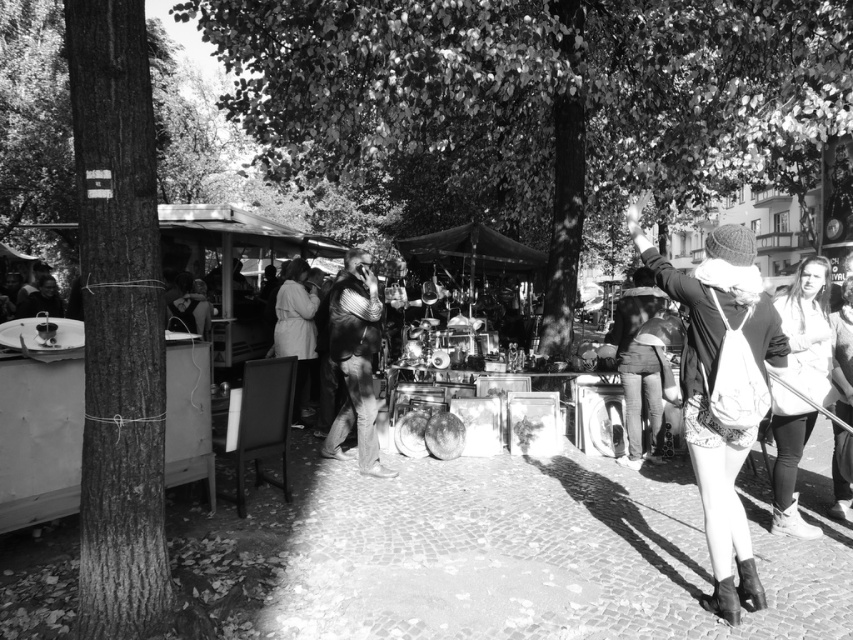
Question: Can you confirm if leather jacket at center is smaller than light beige fabric coat at center?

Choices:
 (A) no
 (B) yes

Answer: (A)

Question: Among these points, which one is nearest to the camera?

Choices:
 (A) (767, 300)
 (B) (300, 284)

Answer: (A)

Question: Which point is farther to the camera?

Choices:
 (A) (378, 328)
 (B) (732, 508)

Answer: (A)

Question: Can you confirm if white textured sweater at right is smaller than leather jacket at center?

Choices:
 (A) no
 (B) yes

Answer: (A)

Question: Is knitted wool hat at upper right wider than light beige fabric coat at center?

Choices:
 (A) no
 (B) yes

Answer: (B)

Question: Which object appears farthest from the camera in this image?

Choices:
 (A) knitted wool hat at upper right
 (B) light beige fabric coat at center
 (C) white textured sweater at right
 (D) leather jacket at center

Answer: (B)